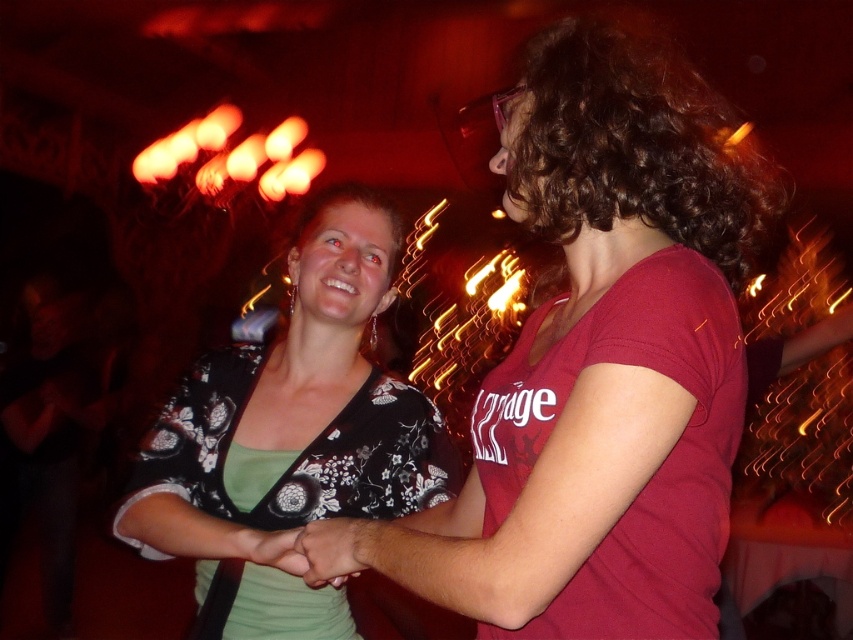
Describe the element at coordinates (633, 145) in the screenshot. I see `dark brown curly hair at upper right` at that location.

Is dark brown curly hair at upper right positioned in front of smooth skin hand at center?

No, dark brown curly hair at upper right is further to the viewer.

Which is behind, point (637, 154) or point (351, 556)?

Point (351, 556)

The height and width of the screenshot is (640, 853). I want to click on dark brown curly hair at upper right, so click(x=633, y=145).

Is matte floral blouse at center to the right of dark brown curly hair at upper right from the viewer's perspective?

In fact, matte floral blouse at center is to the left of dark brown curly hair at upper right.

The image size is (853, 640). What do you see at coordinates (602, 362) in the screenshot?
I see `matte floral blouse at center` at bounding box center [602, 362].

Does point (608, 216) come closer to viewer compared to point (508, 177)?

Yes, it is.

This screenshot has height=640, width=853. Identify the location of matte floral blouse at center. (602, 362).

Can you confirm if floral-patterned blouse at center is taller than smooth skin hand at center?

Yes.

Is point (337, 291) farther from viewer compared to point (352, 534)?

Yes, point (337, 291) is behind point (352, 534).

At what (x,y) coordinates should I click in order to perform the action: click on floral-patterned blouse at center. Please return your answer as a coordinate pair (x, y). The image size is (853, 640). Looking at the image, I should click on (289, 438).